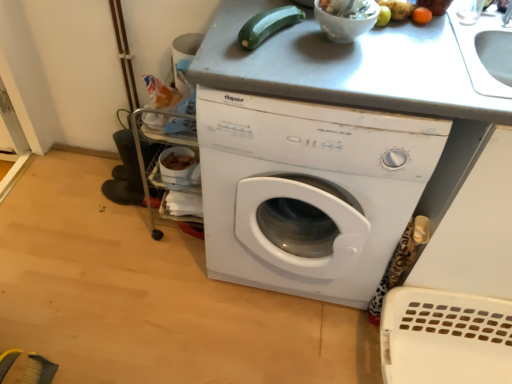
Question: Which direction should I rotate to face green matte zucchini at upper center, which ranks as the 1th vegetable in left-to-right order, — up or down?

Choices:
 (A) down
 (B) up

Answer: (B)

Question: Considering the relative sizes of green matte zucchini at upper center, the 2th vegetable from the right, and white glossy bowl at upper center in the image provided, is green matte zucchini at upper center, the 2th vegetable from the right, thinner than white glossy bowl at upper center?

Choices:
 (A) no
 (B) yes

Answer: (A)

Question: From a real-world perspective, does green matte zucchini at upper center, which ranks as the 1th vegetable in left-to-right order, sit lower than white glossy bowl at upper center?

Choices:
 (A) no
 (B) yes

Answer: (B)

Question: Considering the relative sizes of green matte zucchini at upper center, the 2th vegetable from the right, and white glossy bowl at upper center in the image provided, is green matte zucchini at upper center, the 2th vegetable from the right, wider than white glossy bowl at upper center?

Choices:
 (A) no
 (B) yes

Answer: (B)

Question: Is green matte zucchini at upper center, the 2th vegetable from the right, shorter than white glossy bowl at upper center?

Choices:
 (A) no
 (B) yes

Answer: (B)

Question: Is green matte zucchini at upper center, the 2th vegetable from the right, oriented away from white glossy bowl at upper center?

Choices:
 (A) yes
 (B) no

Answer: (B)

Question: Is green matte zucchini at upper center, the 2th vegetable from the right, oriented towards white glossy bowl at upper center?

Choices:
 (A) no
 (B) yes

Answer: (A)

Question: From a real-world perspective, is white glossy bowl at upper center positioned over white glossy bowl at upper center based on gravity?

Choices:
 (A) yes
 (B) no

Answer: (A)

Question: Is white glossy bowl at upper center looking in the opposite direction of white glossy bowl at upper center?

Choices:
 (A) no
 (B) yes

Answer: (A)

Question: Considering the relative sizes of white glossy bowl at upper center and white glossy bowl at upper center in the image provided, is white glossy bowl at upper center bigger than white glossy bowl at upper center?

Choices:
 (A) yes
 (B) no

Answer: (B)

Question: Does white glossy bowl at upper center have a greater width compared to white glossy bowl at upper center?

Choices:
 (A) no
 (B) yes

Answer: (A)

Question: Is white glossy bowl at upper center surrounding white glossy bowl at upper center?

Choices:
 (A) yes
 (B) no

Answer: (B)

Question: Considering the relative sizes of white glossy bowl at upper center and white glossy bowl at upper center in the image provided, is white glossy bowl at upper center taller than white glossy bowl at upper center?

Choices:
 (A) yes
 (B) no

Answer: (A)

Question: Is orange matte fruit at upper right, the second vegetable from the left, at the right side of white plastic washing machine at center?

Choices:
 (A) yes
 (B) no

Answer: (A)